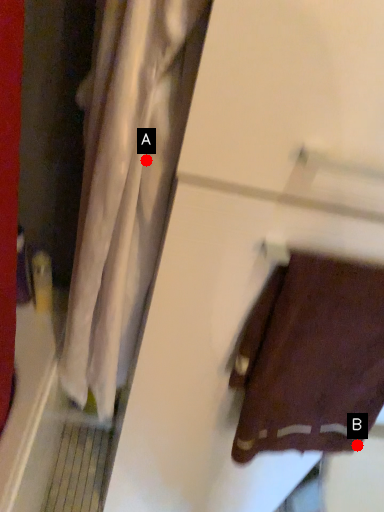
Question: Two points are circled on the image, labeled by A and B beside each circle. Which point appears farthest from the camera in this image?

Choices:
 (A) A is further
 (B) B is further

Answer: (B)